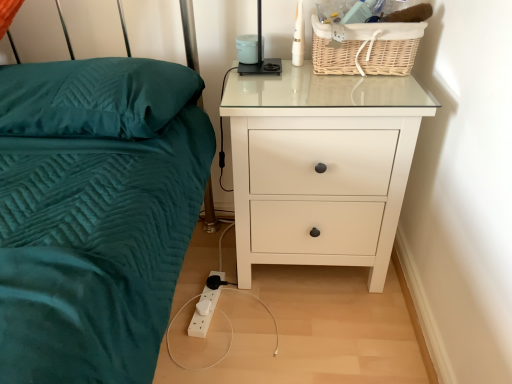
This screenshot has height=384, width=512. Find the location of `free point below black plastic lamp at upper center (from a real-world perspective)`. free point below black plastic lamp at upper center (from a real-world perspective) is located at coordinates (261, 64).